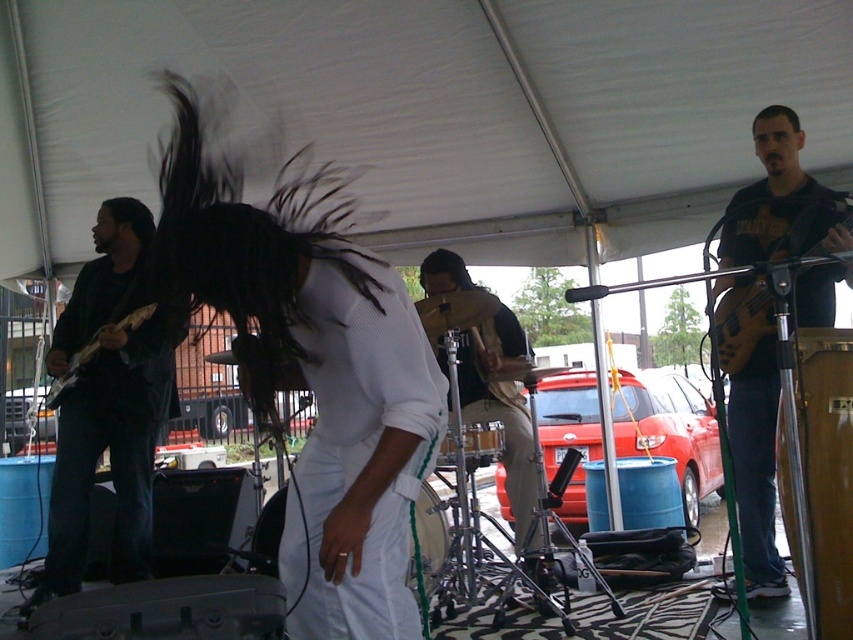
You are a photographer at the music event and want to capture a photo of the matte black guitar at right and the matte brown electric guitar at right. Which guitar should you focus on if you want to include both in the frame without cropping?

The matte black guitar at right is much taller than the matte brown electric guitar at right, so focusing on the taller matte black guitar at right would ensure both guitars fit in the frame without cropping.

You are a stagehand setting up equipment for the band. You have two guitars on stage, the matte black guitar at left and the matte black electric guitar at left. Which one requires more space to store?

The matte black guitar at left requires more space to store because it is larger in size than the matte black electric guitar at left.

Where is the matte black guitar at left located in the image?

The matte black guitar at left is located at point (x=109, y=400) in the image.